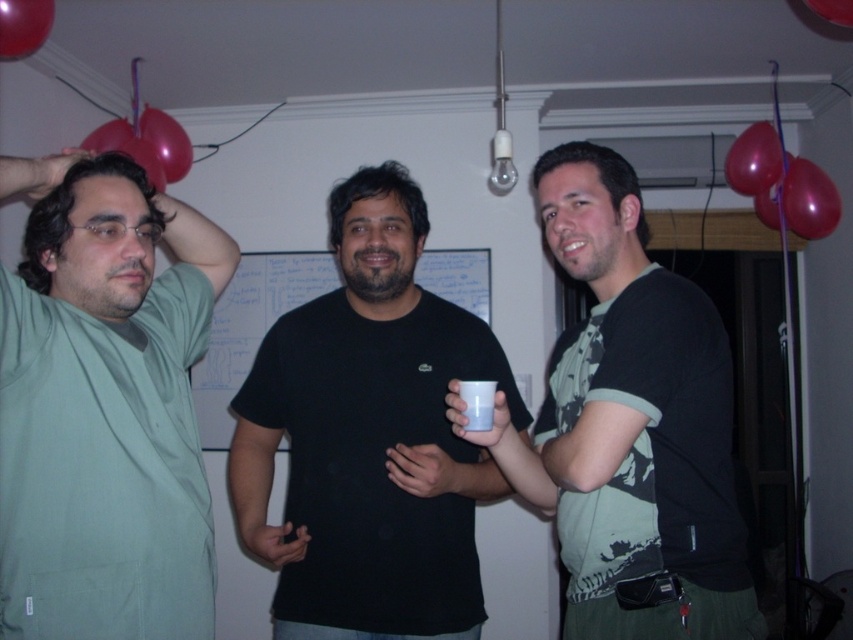
Question: Among these objects, which one is farthest from the camera?

Choices:
 (A) red matte balloon at upper left
 (B) satin red balloon at upper right

Answer: (B)

Question: Can you confirm if green matte shirt at left is bigger than rubber heart at upper right?

Choices:
 (A) no
 (B) yes

Answer: (B)

Question: Which point is closer to the camera?

Choices:
 (A) (20, 54)
 (B) (422, 524)

Answer: (B)

Question: Which object appears closest to the camera in this image?

Choices:
 (A) satin red balloon at upper right
 (B) red matte balloon at upper left
 (C) rubber heart at upper right

Answer: (B)

Question: Is red matte balloon at upper left positioned in front of white matte cup at center?

Choices:
 (A) no
 (B) yes

Answer: (A)

Question: Does white matte bulletin board at center have a greater width compared to red rubber balloon at upper left?

Choices:
 (A) yes
 (B) no

Answer: (A)